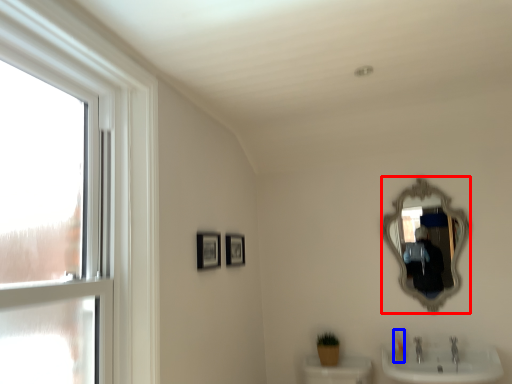
Question: Among these objects, which one is farthest to the camera, mirror (highlighted by a red box) or toiletry (highlighted by a blue box)?

Choices:
 (A) mirror
 (B) toiletry

Answer: (B)